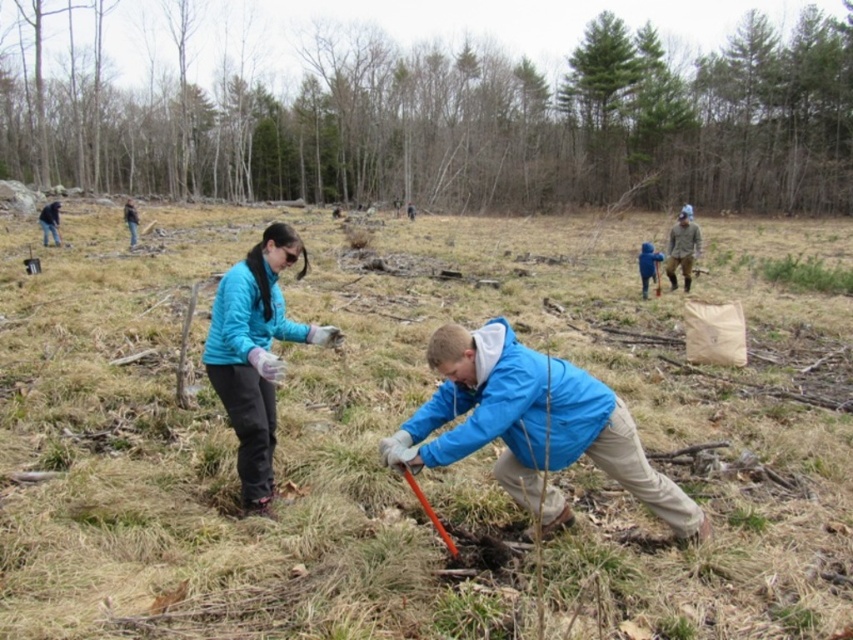
Question: Does green leafy tree at upper center appear on the left side of blue matte jacket at center?

Choices:
 (A) yes
 (B) no

Answer: (A)

Question: Does gray woolen sweater at right appear on the right side of dark brown leather jacket at upper left?

Choices:
 (A) yes
 (B) no

Answer: (A)

Question: Based on their relative distances, which object is farther from the blue fabric jacket at center?

Choices:
 (A) blue matte jacket at center
 (B) dark brown leather jacket at upper left
 (C) gray woolen sweater at right
 (D) teal fabric jacket at lower center

Answer: (D)

Question: Which point appears closest to the camera in this image?

Choices:
 (A) (407, 211)
 (B) (235, 426)
 (C) (44, 241)

Answer: (B)

Question: Which point is closer to the camera?

Choices:
 (A) blue fabric jacket at center
 (B) teal fabric jacket at lower center
 (C) gray woolen sweater at right

Answer: (B)

Question: Can you confirm if green leafy tree at upper center is positioned above dark blue jacket at upper left?

Choices:
 (A) no
 (B) yes

Answer: (B)